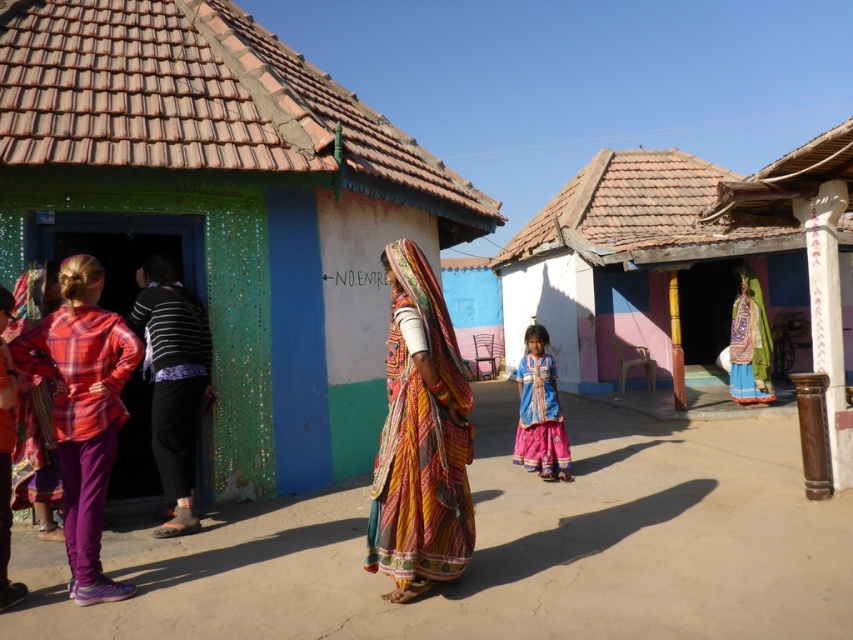
Question: Which object appears closest to the camera in this image?

Choices:
 (A) blue painted wall at left
 (B) multicolored fabric saree at center
 (C) striped fabric dress at left
 (D) wooden column at right

Answer: (B)

Question: Which object is positioned closest to the multicolored fabric saree at center?

Choices:
 (A) embroidered silk saree at center
 (B) wooden column at right
 (C) plaid fabric shirt at left
 (D) white painted wood hut at center

Answer: (C)

Question: Is multicolored fabric saree at center above striped fabric dress at left?

Choices:
 (A) no
 (B) yes

Answer: (A)

Question: Which is nearer to the blue cotton dress at center?

Choices:
 (A) white painted wood hut at center
 (B) striped fabric dress at left
 (C) blue painted wall at left
 (D) plaid fabric shirt at left

Answer: (C)

Question: Does blue painted wall at left have a greater width compared to multicolored fabric saree at center?

Choices:
 (A) no
 (B) yes

Answer: (B)

Question: Can you confirm if white painted wood hut at center is wider than blue cotton dress at center?

Choices:
 (A) no
 (B) yes

Answer: (B)